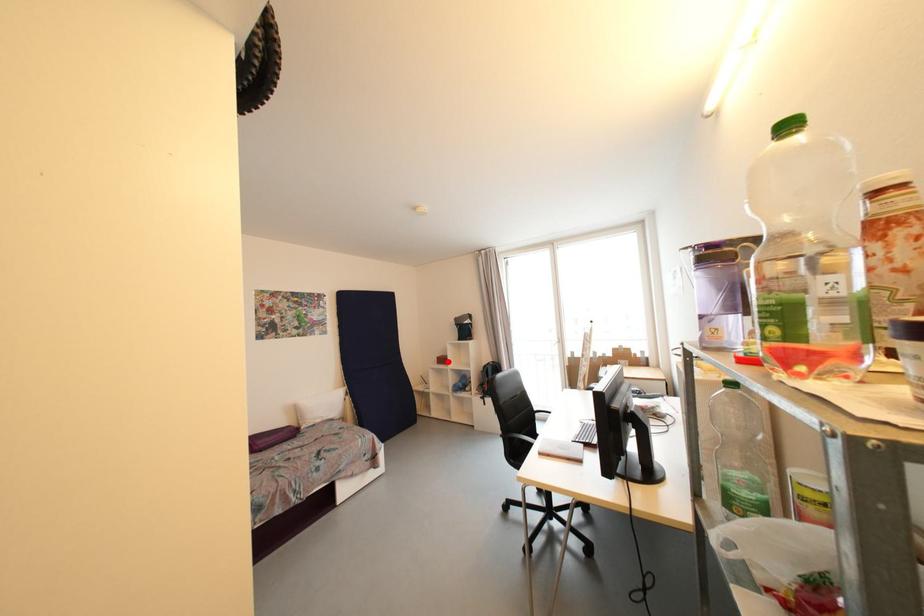
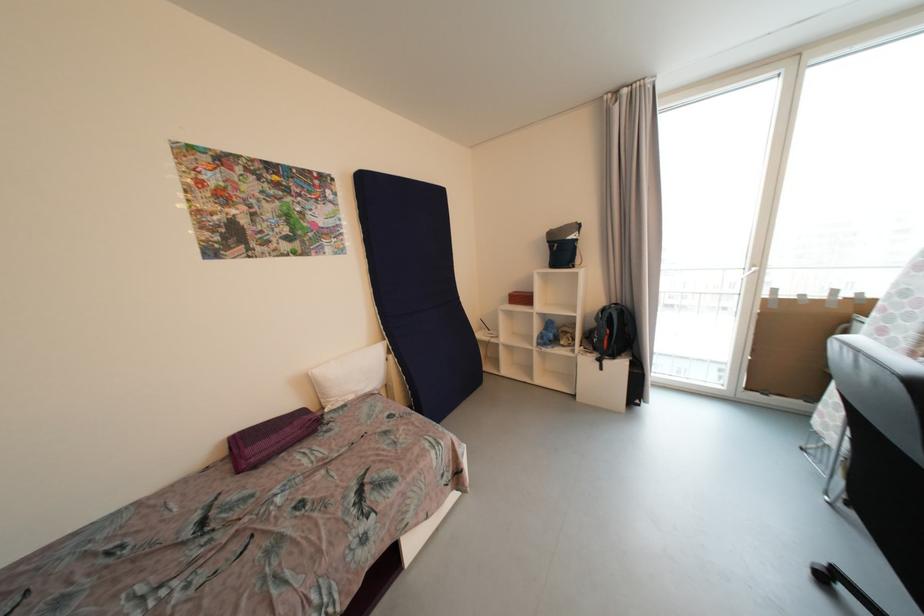
In the second image, find the point that corresponds to the highlighted location in the first image.

(528, 300)